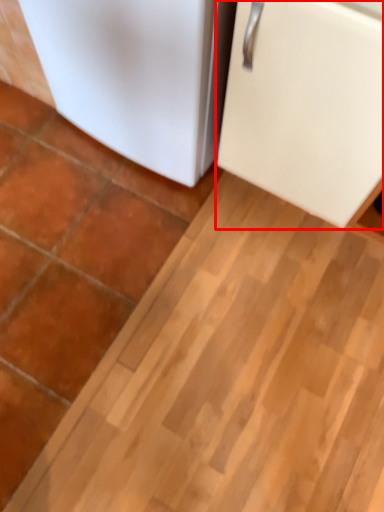
Question: In this image, where is refrigerator (annotated by the red box) located relative to refrigerator?

Choices:
 (A) left
 (B) right

Answer: (B)